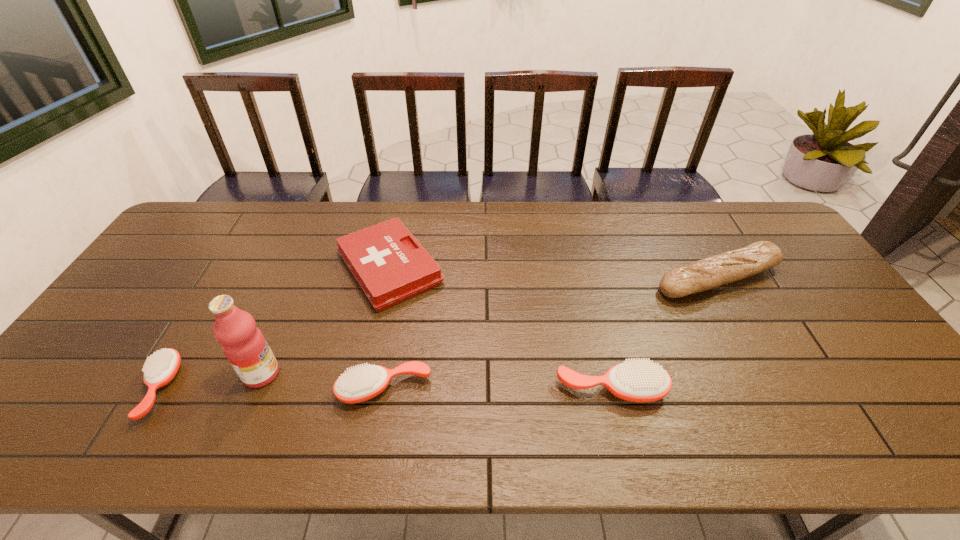
At what (x,y) coordinates should I click in order to perform the action: click on the leftmost hairbrush. Please return your answer as a coordinate pair (x, y). The image size is (960, 540). Looking at the image, I should click on (160, 369).

I want to click on the shortest hairbrush, so click(x=160, y=369).

At what (x,y) coordinates should I click in order to perform the action: click on the second shortest hairbrush. Please return your answer as a coordinate pair (x, y). The image size is (960, 540). Looking at the image, I should click on (359, 384).

At what (x,y) coordinates should I click in order to perform the action: click on the rightmost hairbrush. Please return your answer as a coordinate pair (x, y). The height and width of the screenshot is (540, 960). Looking at the image, I should click on (640, 381).

Where is `the first-aid kit`? The height and width of the screenshot is (540, 960). the first-aid kit is located at coordinates (390, 265).

Where is `the tallest object`? Image resolution: width=960 pixels, height=540 pixels. the tallest object is located at coordinates (244, 345).

Identify the location of the second object from left to right. (244, 345).

At what (x,y) coordinates should I click in order to perform the action: click on baguet. Please return your answer as a coordinate pair (x, y). This screenshot has width=960, height=540. Looking at the image, I should click on (708, 273).

In order to click on free region located on the back of the leftmost hairbrush in this screenshot , I will do `click(205, 309)`.

Identify the location of blank area located 0.180m on the left of the second tallest hairbrush. pos(263,389).